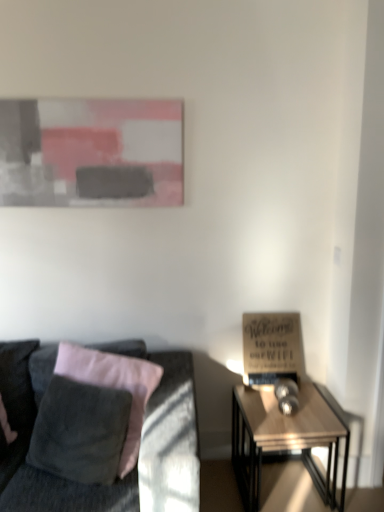
Question: Considering the relative positions of matte gray painting at upper center and velvet gray couch at left in the image provided, is matte gray painting at upper center to the right of velvet gray couch at left from the viewer's perspective?

Choices:
 (A) yes
 (B) no

Answer: (A)

Question: Does matte gray painting at upper center have a smaller size compared to velvet gray couch at left?

Choices:
 (A) yes
 (B) no

Answer: (A)

Question: Considering the relative sizes of matte gray painting at upper center and velvet gray couch at left in the image provided, is matte gray painting at upper center taller than velvet gray couch at left?

Choices:
 (A) yes
 (B) no

Answer: (B)

Question: Does matte gray painting at upper center lie behind velvet gray couch at left?

Choices:
 (A) yes
 (B) no

Answer: (A)

Question: Is matte gray painting at upper center not inside velvet gray couch at left?

Choices:
 (A) yes
 (B) no

Answer: (A)

Question: Is velvet gray couch at left completely or partially inside matte gray painting at upper center?

Choices:
 (A) yes
 (B) no

Answer: (B)

Question: Is velvet gray couch at left not close to wooden sign at right?

Choices:
 (A) yes
 (B) no

Answer: (B)

Question: Is velvet gray couch at left taller than wooden sign at right?

Choices:
 (A) no
 (B) yes

Answer: (B)

Question: Is velvet gray couch at left facing towards wooden sign at right?

Choices:
 (A) yes
 (B) no

Answer: (B)

Question: Does velvet gray couch at left come in front of wooden sign at right?

Choices:
 (A) yes
 (B) no

Answer: (A)

Question: Can we say velvet gray couch at left lies outside wooden sign at right?

Choices:
 (A) yes
 (B) no

Answer: (A)

Question: Does velvet gray couch at left have a lesser height compared to wooden sign at right?

Choices:
 (A) no
 (B) yes

Answer: (A)

Question: Could wooden glossy table at right be considered to be inside velvet gray couch at left?

Choices:
 (A) yes
 (B) no

Answer: (B)